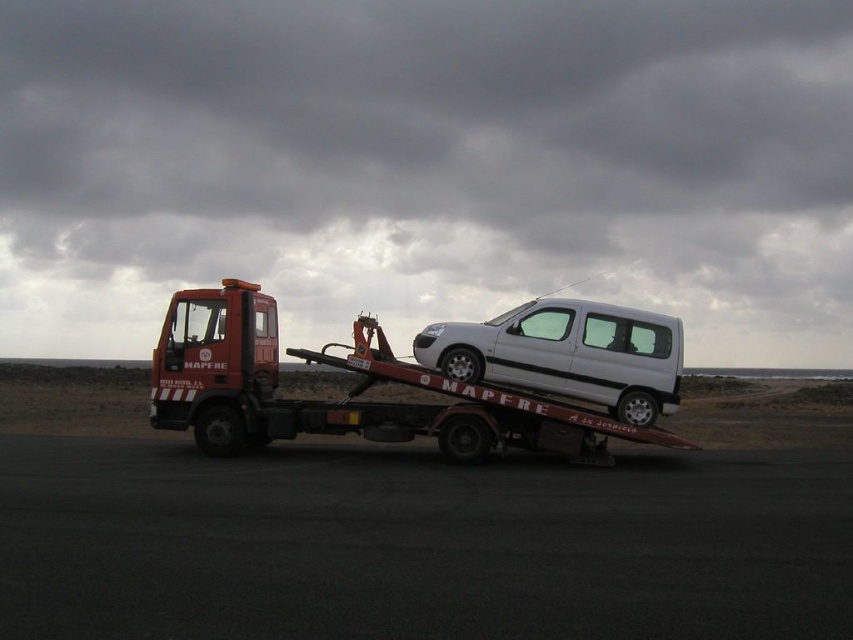
Is matte red tow truck at center closer to camera compared to white matte van at center?

Yes, it is in front of white matte van at center.

Which is behind, point (247, 326) or point (672, 401)?

The point (247, 326) is behind.

Measure the distance between matte red tow truck at center and camera.

matte red tow truck at center is 12.62 meters from camera.

Find the location of a particular element. matte red tow truck at center is located at coordinates (346, 394).